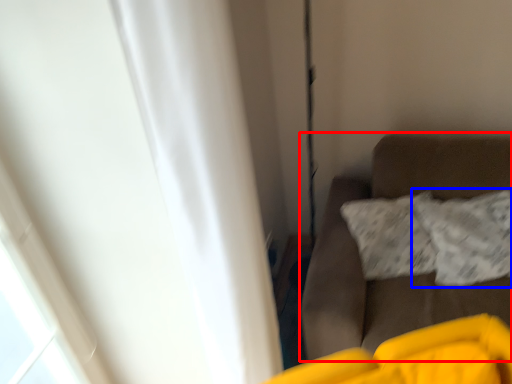
Question: Which point is further to the camera, furniture (highlighted by a red box) or pillow (highlighted by a blue box)?

Choices:
 (A) furniture
 (B) pillow

Answer: (B)